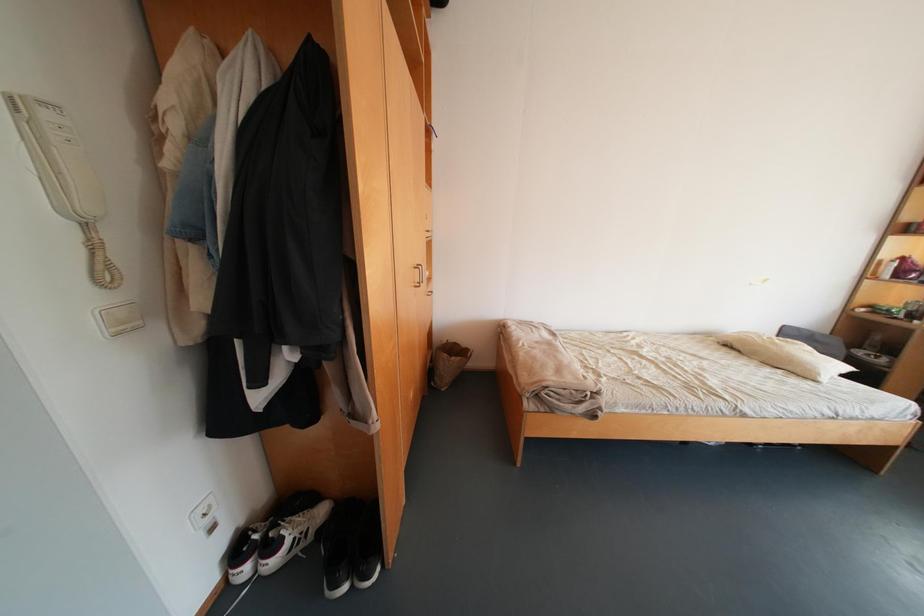
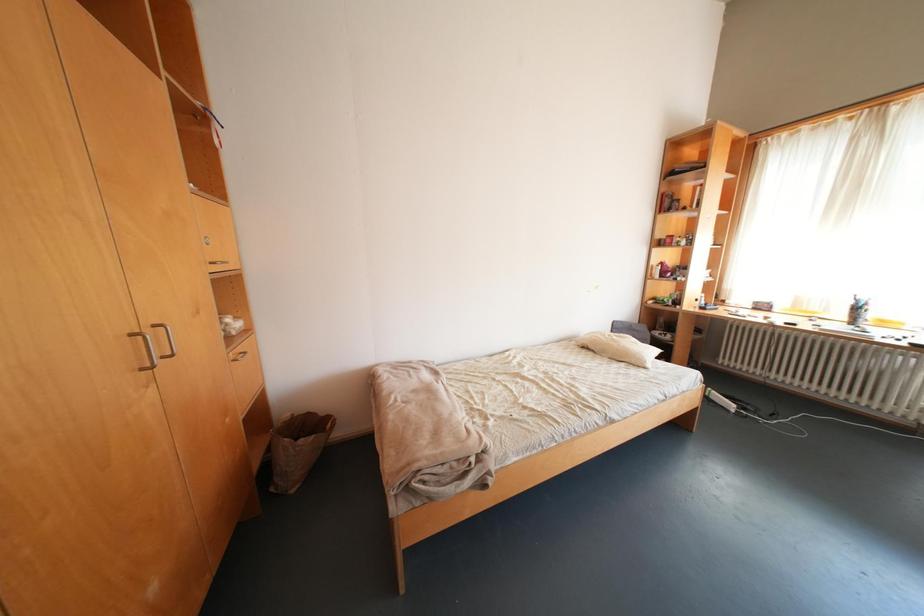
Which direction would the cameraman need to move to produce the second image?

The cameraman moved toward right, forward.